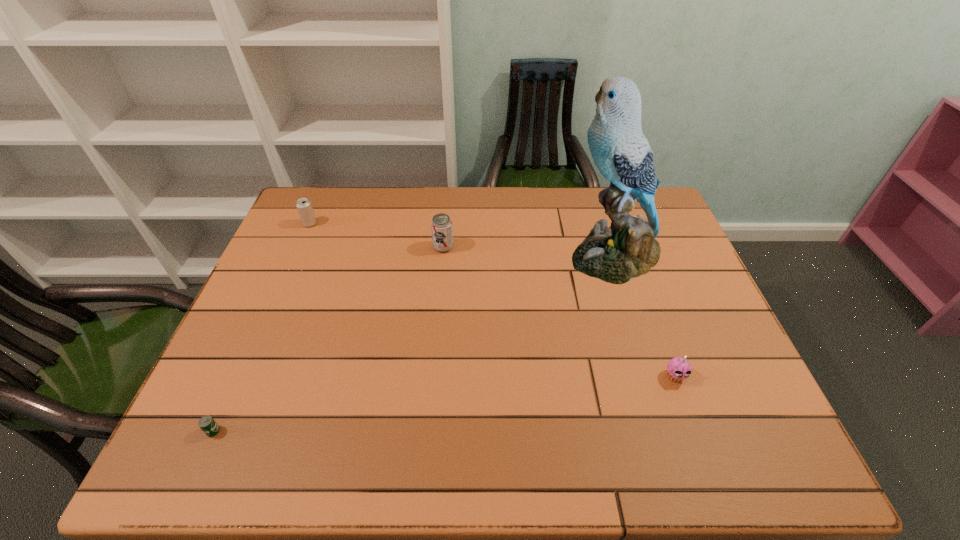
In order to click on object that is at the far left corner in this screenshot , I will do `click(303, 205)`.

You are a GUI agent. You are given a task and a screenshot of the screen. Output one action in this format:
    pyautogui.click(x=<x>, y=<y>)
    Task: Click on the object present at the near left corner
    This screenshot has height=540, width=960.
    Given the screenshot: What is the action you would take?
    pyautogui.click(x=207, y=424)

Image resolution: width=960 pixels, height=540 pixels. I want to click on object that is at the far right corner, so pyautogui.click(x=627, y=249).

Locate an element on the screen. This screenshot has width=960, height=540. vacant point at the far edge is located at coordinates (497, 219).

You are a GUI agent. You are given a task and a screenshot of the screen. Output one action in this format:
    pyautogui.click(x=<x>, y=<y>)
    Task: Click on the vacant space at the near edge of the desktop
    Image resolution: width=960 pixels, height=540 pixels.
    Given the screenshot: What is the action you would take?
    pyautogui.click(x=439, y=431)

Where is `vacant space at the left edge of the desktop`? The image size is (960, 540). vacant space at the left edge of the desktop is located at coordinates (259, 302).

Identify the location of vacant space at the right edge. The image size is (960, 540). (674, 339).

This screenshot has height=540, width=960. I want to click on vacant area at the near right corner of the desktop, so click(x=738, y=451).

The width and height of the screenshot is (960, 540). Identify the location of free point between the cupcake and the second shortest beer can. (492, 300).

Locate an element on the screen. The width and height of the screenshot is (960, 540). vacant point located between the tallest beer can and the nearest object is located at coordinates (328, 339).